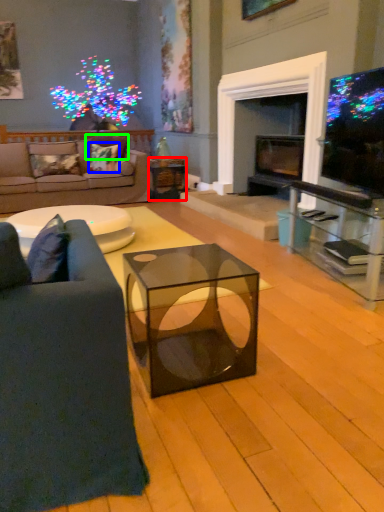
Question: Which object is positioned farthest from side table (highlighted by a red box)? Select from pillow (highlighted by a blue box) and pillow (highlighted by a green box).

Choices:
 (A) pillow
 (B) pillow

Answer: (B)